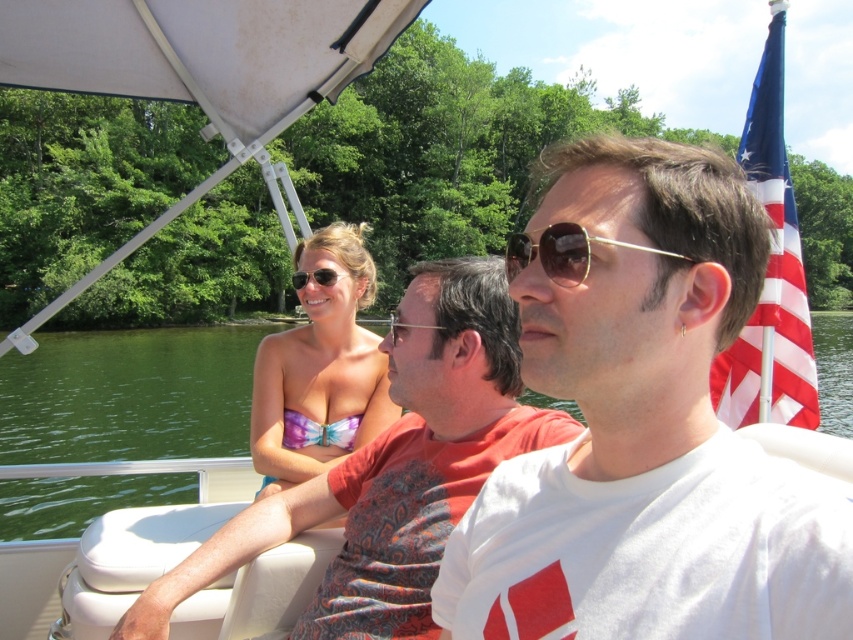
Question: Is matte white t-shirt at center further to camera compared to green water at center?

Choices:
 (A) no
 (B) yes

Answer: (B)

Question: Considering the real-world distances, which object is closest to the purple tie-dye bikini top at center?

Choices:
 (A) white cotton t-shirt at center
 (B) green water at center
 (C) gold metallic sunglasses at center

Answer: (C)

Question: Where is green water at center located in relation to purple tie-dye bikini top at center in the image?

Choices:
 (A) left
 (B) right

Answer: (B)

Question: Considering the real-world distances, which object is farthest from the white cotton t-shirt at center?

Choices:
 (A) matte white t-shirt at center
 (B) gold metallic sunglasses at center
 (C) green water at center
 (D) purple tie-dye bikini top at center

Answer: (C)

Question: In this image, where is white cotton t-shirt at center located relative to purple tie-dye bikini top at center?

Choices:
 (A) right
 (B) left

Answer: (A)

Question: Among these objects, which one is farthest from the camera?

Choices:
 (A) gold metallic sunglasses at center
 (B) purple tie-dye bikini top at center
 (C) white cotton t-shirt at center

Answer: (B)